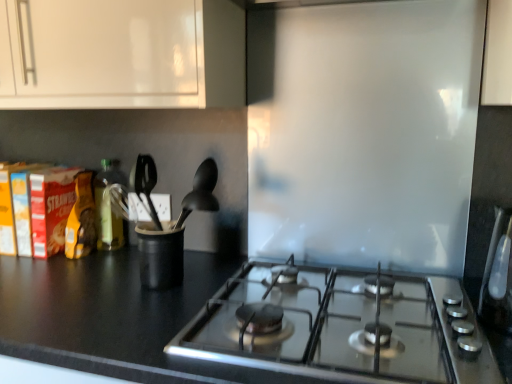
Find the location of `space that is in front of black plastic utensil holder at center`. space that is in front of black plastic utensil holder at center is located at coordinates (139, 311).